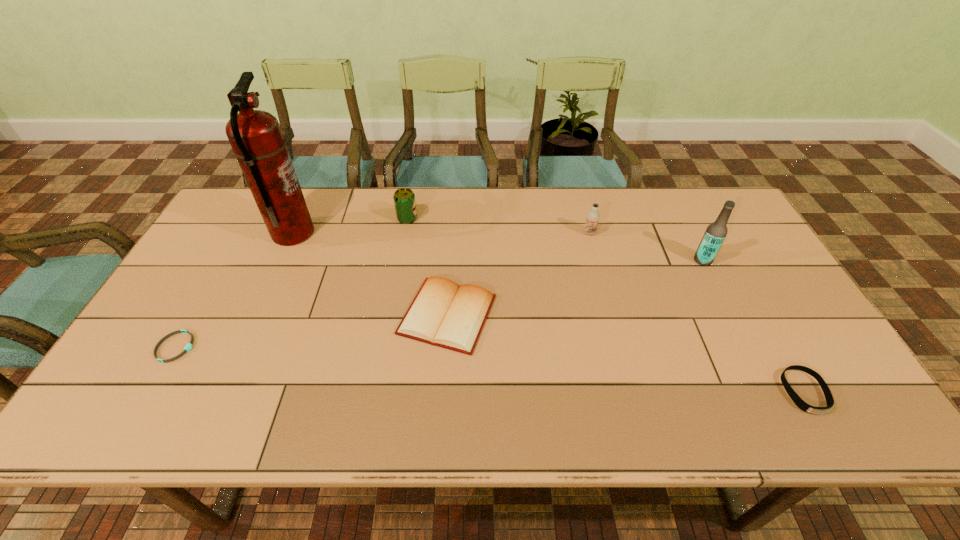
Locate an element on the screen. free point between the beer bottle and the right wristband is located at coordinates (754, 326).

The image size is (960, 540). I want to click on free space between the nearer wristband and the tallest object, so click(x=548, y=313).

Image resolution: width=960 pixels, height=540 pixels. In order to click on vacant space that is in between the second object from left to right and the Bible in this screenshot , I will do `click(371, 274)`.

Where is `empty location between the fire extinguisher and the fifth tallest object`? empty location between the fire extinguisher and the fifth tallest object is located at coordinates (371, 274).

This screenshot has height=540, width=960. Identify the location of the closest object to the nearest object. (716, 232).

Identify which object is the sixth nearest to the farther wristband. Please provide its 2D coordinates. Your answer should be formatted as a tuple, i.e. [(x, y)], where the tuple contains the x and y coordinates of a point satisfying the conditions above.

[(801, 404)]

Locate an element on the screen. This screenshot has height=540, width=960. vacant space that satisfies the following two spatial constraints: 1. on the back side of the chocolate milk; 2. on the right side of the Bible is located at coordinates (453, 233).

The height and width of the screenshot is (540, 960). Identify the location of vacant space that satisfies the following two spatial constraints: 1. on the side of the third shortest object with the handle and hose; 2. on the right side of the tallest object. (256, 315).

This screenshot has height=540, width=960. I want to click on free region that satisfies the following two spatial constraints: 1. on the front side of the third shortest object; 2. on the buckle of the leftmost object, so click(445, 347).

Identify the location of vacant point that satisfies the following two spatial constraints: 1. on the side of the tallest object with the handle and hose; 2. on the back side of the Bible. (256, 315).